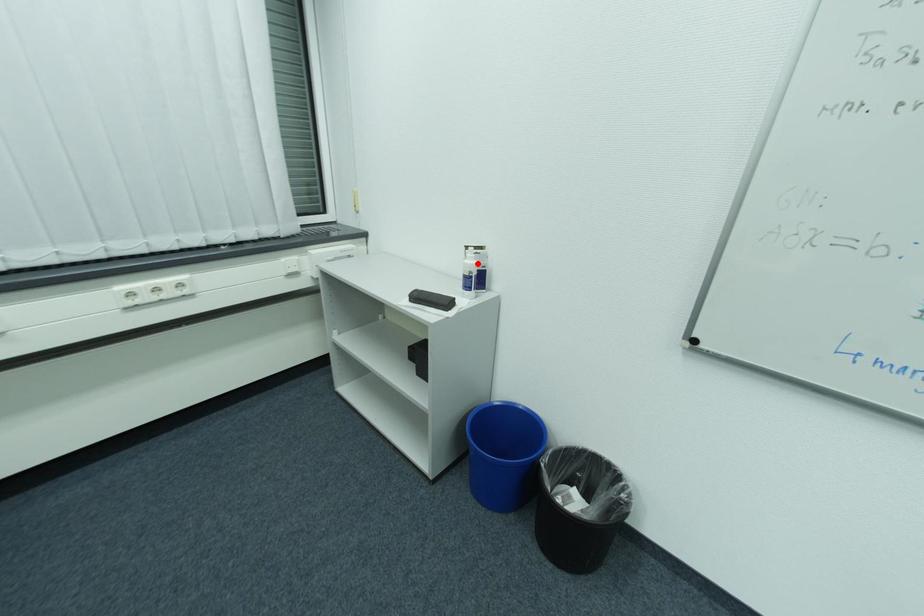
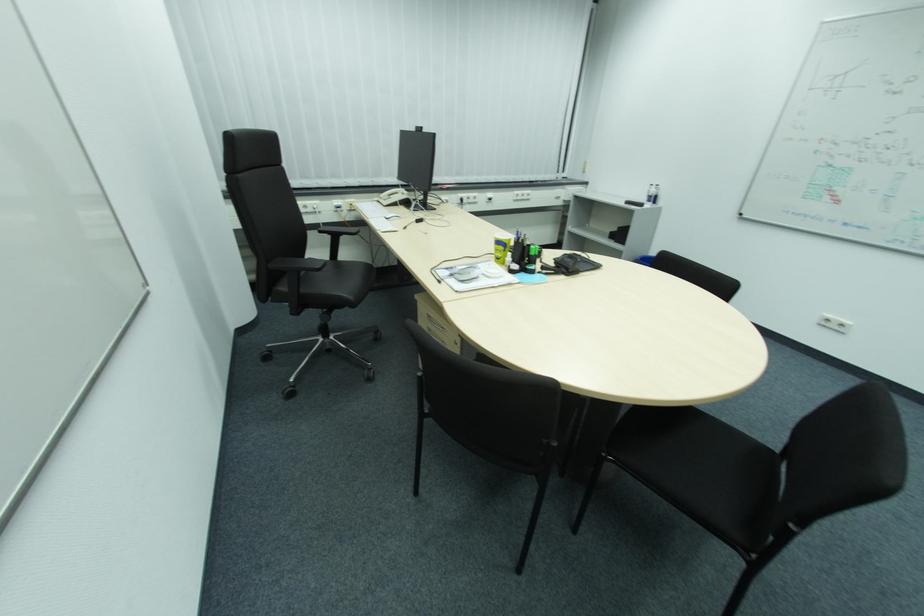
Locate, in the second image, the point that corresponds to the highlighted location in the first image.

(660, 191)